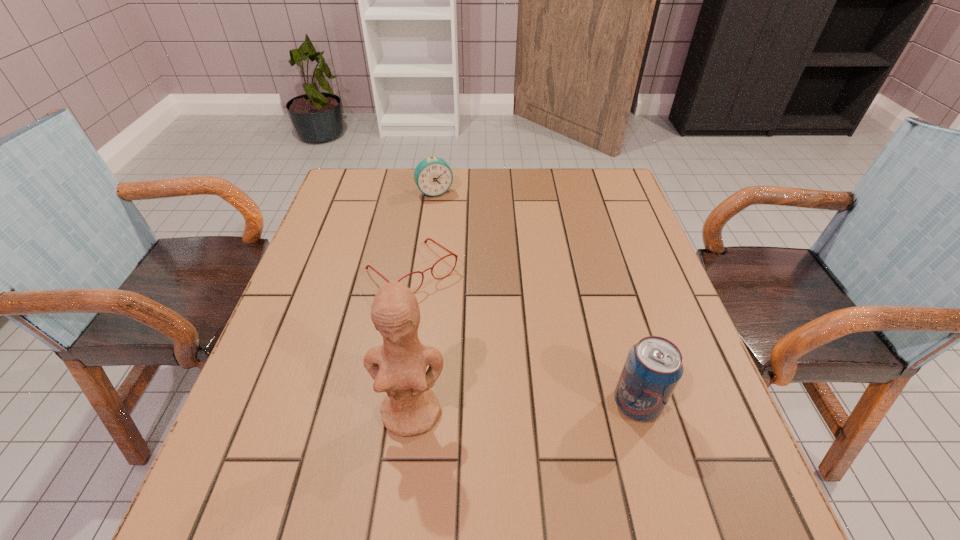
Locate an element on the screen. The image size is (960, 540). figurine is located at coordinates pyautogui.click(x=398, y=367).

The image size is (960, 540). In order to click on the rightmost object in this screenshot , I will do `click(653, 368)`.

Image resolution: width=960 pixels, height=540 pixels. What are the coordinates of `pop soda` in the screenshot? It's located at (653, 368).

The width and height of the screenshot is (960, 540). I want to click on the shortest object, so pyautogui.click(x=425, y=241).

Identify the location of the third nearest object. This screenshot has height=540, width=960. (425, 241).

Image resolution: width=960 pixels, height=540 pixels. What are the coordinates of `alarm clock` in the screenshot? It's located at (433, 176).

Find the location of a particular element. Image resolution: width=960 pixels, height=540 pixels. the farthest object is located at coordinates (433, 176).

Locate an element on the screen. This screenshot has height=540, width=960. free point located on the left of the third shortest object is located at coordinates (560, 404).

Locate an element on the screen. The width and height of the screenshot is (960, 540). blank space located 0.290m on the face of the spectacles is located at coordinates (522, 379).

Where is `free space located 0.190m on the face of the spectacles`? free space located 0.190m on the face of the spectacles is located at coordinates (490, 347).